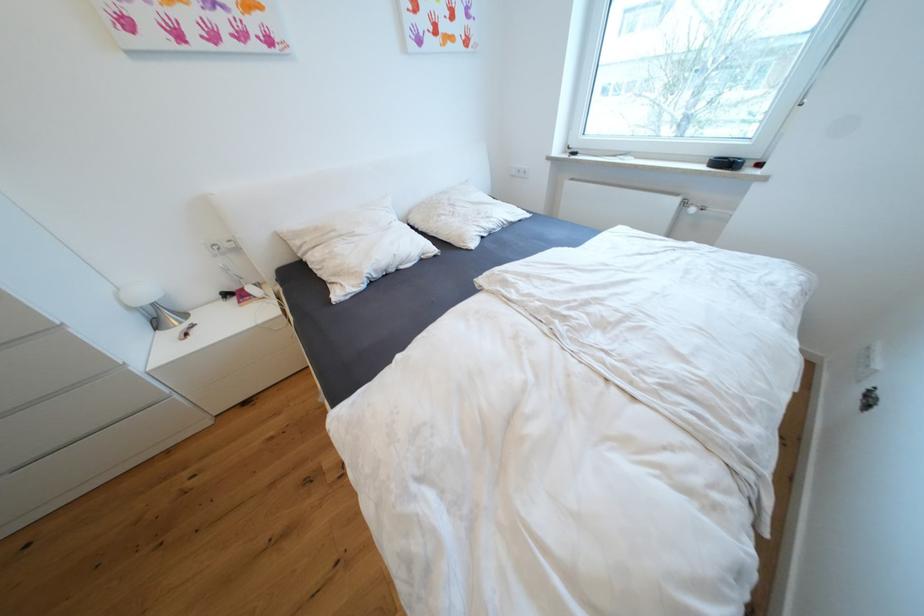
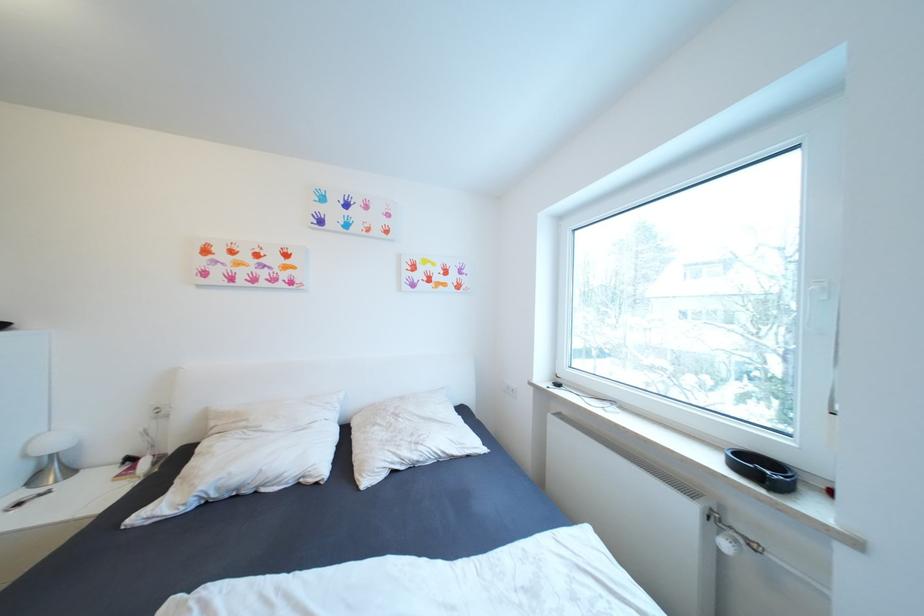
Find the pixel in the second image that matches the point at 152,296 in the first image.

(63, 445)